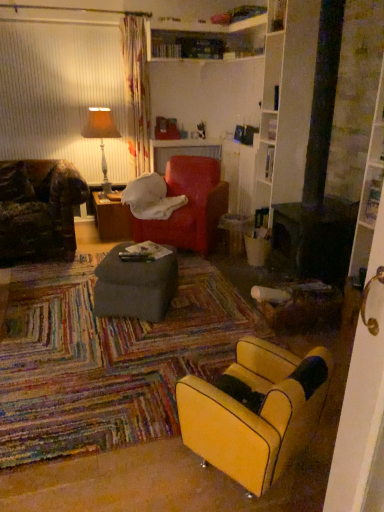
At what (x,y) coordinates should I click in order to perform the action: click on vacant point to the right of matte gray ottoman at center, the first table viewed from the front. Please return your answer as a coordinate pair (x, y). This screenshot has height=512, width=384. Looking at the image, I should click on (201, 302).